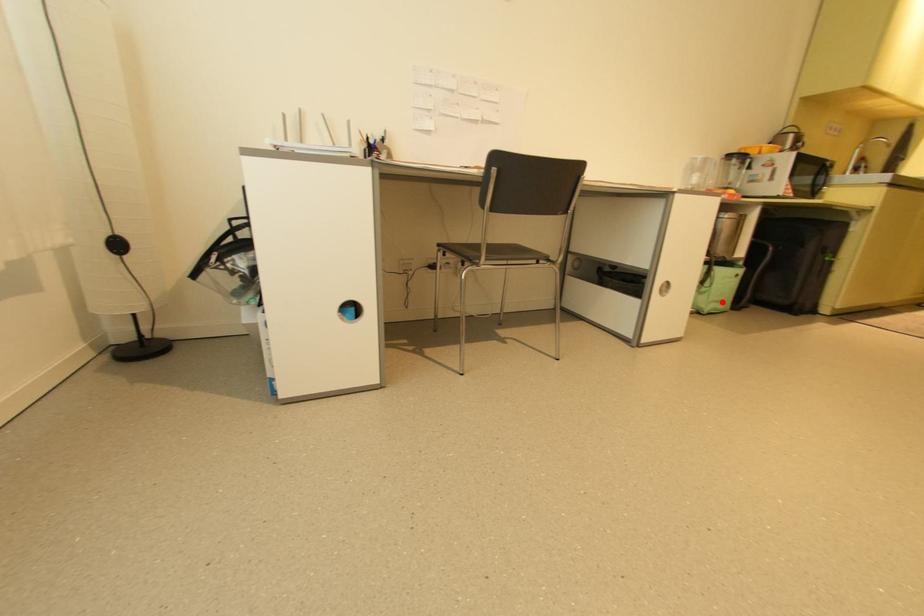
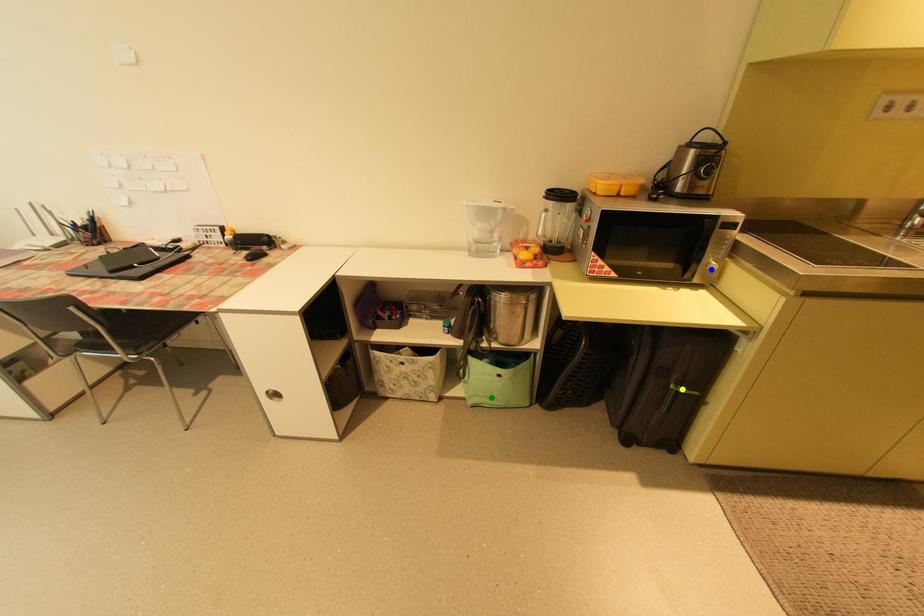
Question: I am providing you with two images of the same scene from different viewpoints. A red point is marked on the first image. You are given multiple points on the second image. Which point in image 2 represents the same 3d spot as the red point in image 1?

Choices:
 (A) blue point
 (B) green point
 (C) yellow point

Answer: (B)